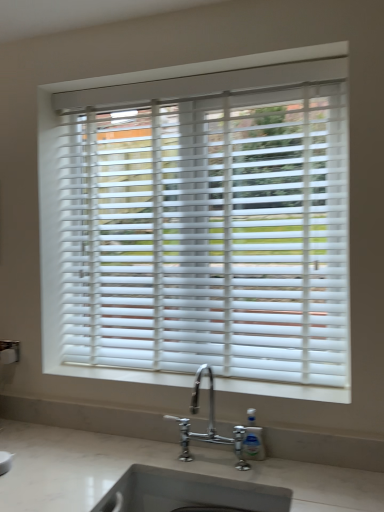
Image resolution: width=384 pixels, height=512 pixels. In order to click on free spot above white marble sink at lower center (from a real-world perspective) in this screenshot , I will do `click(220, 462)`.